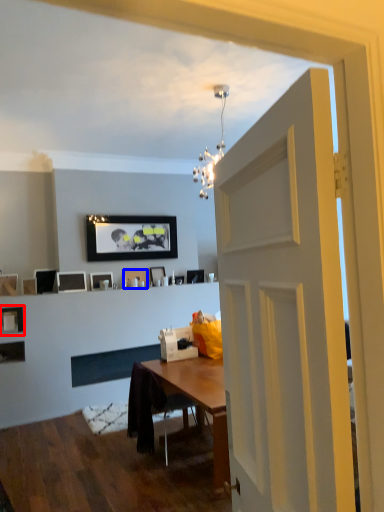
Question: Which object is closer to the camera taking this photo, picture frame (highlighted by a red box) or picture frame (highlighted by a blue box)?

Choices:
 (A) picture frame
 (B) picture frame

Answer: (A)